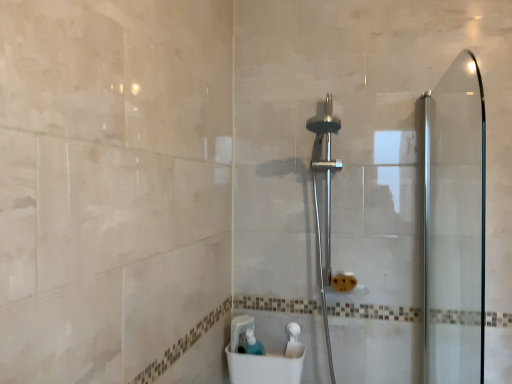
Question: Does white plastic sink at lower center appear on the left side of transparent glass screen door at right?

Choices:
 (A) yes
 (B) no

Answer: (A)

Question: Could you tell me if white plastic sink at lower center is turned towards transparent glass screen door at right?

Choices:
 (A) no
 (B) yes

Answer: (A)

Question: From a real-world perspective, is white plastic sink at lower center physically above transparent glass screen door at right?

Choices:
 (A) yes
 (B) no

Answer: (B)

Question: Can you confirm if white plastic sink at lower center is bigger than transparent glass screen door at right?

Choices:
 (A) yes
 (B) no

Answer: (B)

Question: From a real-world perspective, is white plastic sink at lower center beneath transparent glass screen door at right?

Choices:
 (A) yes
 (B) no

Answer: (A)

Question: Is white plastic sink at lower center bigger or smaller than transparent glass screen door at right?

Choices:
 (A) big
 (B) small

Answer: (B)

Question: From a real-world perspective, is white plastic sink at lower center above or below transparent glass screen door at right?

Choices:
 (A) above
 (B) below

Answer: (B)

Question: Is point 266,362 positioned closer to the camera than point 483,296?

Choices:
 (A) farther
 (B) closer

Answer: (A)

Question: Is white plastic sink at lower center taller or shorter than transparent glass screen door at right?

Choices:
 (A) tall
 (B) short

Answer: (B)

Question: From the image's perspective, is polished chrome shower head at center located above or below transparent glass screen door at right?

Choices:
 (A) below
 (B) above

Answer: (A)

Question: In the image, is polished chrome shower head at center positioned in front of or behind transparent glass screen door at right?

Choices:
 (A) front
 (B) behind

Answer: (B)

Question: Visually, is polished chrome shower head at center positioned to the left or to the right of transparent glass screen door at right?

Choices:
 (A) right
 (B) left

Answer: (B)

Question: Choose the correct answer: Is polished chrome shower head at center inside transparent glass screen door at right or outside it?

Choices:
 (A) inside
 (B) outside

Answer: (B)

Question: Looking at their shapes, would you say polished chrome shower head at center is wider or thinner than translucent plastic soap dispenser at lower center?

Choices:
 (A) wide
 (B) thin

Answer: (A)

Question: From the image's perspective, is polished chrome shower head at center above or below translucent plastic soap dispenser at lower center?

Choices:
 (A) above
 (B) below

Answer: (A)